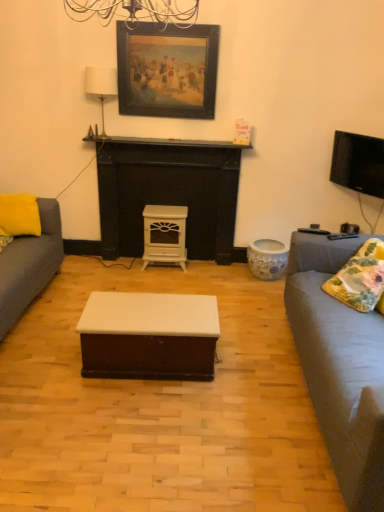
Describe the element at coordinates (340, 367) in the screenshot. This screenshot has height=512, width=384. I see `gray fabric couch at right` at that location.

This screenshot has height=512, width=384. Describe the element at coordinates (19, 215) in the screenshot. I see `yellow fabric pillow at left, which is the 1th pillow in back-to-front order` at that location.

The height and width of the screenshot is (512, 384). Identify the location of floral fabric pillow at right, which is the 1th pillow in right-to-left order. (361, 279).

Find the location of `white glossy wood stove at center`. white glossy wood stove at center is located at coordinates (165, 234).

Is black matte fireplace at center wider or thinner than gray fabric couch at right?

Clearly, black matte fireplace at center has less width compared to gray fabric couch at right.

In the image, is black matte fireplace at center on the left side or the right side of gray fabric couch at right?

Based on their positions, black matte fireplace at center is located to the left of gray fabric couch at right.

Who is smaller, black matte fireplace at center or gray fabric couch at right?

Smaller between the two is black matte fireplace at center.

Considering the points (89, 137) and (323, 389), which point is in front, point (89, 137) or point (323, 389)?

Positioned in front is point (323, 389).

From a real-world perspective, which object rests below the other?

white matte wood coffee table at center.

Is white matte wood coffee table at center facing towards white glossy wood fireplace at center?

Yes, white matte wood coffee table at center is oriented towards white glossy wood fireplace at center.

Considering the sizes of objects white matte wood coffee table at center and white glossy wood fireplace at center in the image provided, who is shorter, white matte wood coffee table at center or white glossy wood fireplace at center?

With less height is white matte wood coffee table at center.

Are white glossy wood fireplace at center and white matte wood coffee table at center located far from each other?

Yes, white glossy wood fireplace at center and white matte wood coffee table at center are quite far apart.

Can you confirm if white glossy wood fireplace at center is taller than white matte wood coffee table at center?

Indeed, white glossy wood fireplace at center has a greater height compared to white matte wood coffee table at center.

Which is behind, white glossy wood fireplace at center or white matte wood coffee table at center?

white glossy wood fireplace at center is further away from the camera.

Measure the distance between white glossy wood fireplace at center and white matte wood coffee table at center.

white glossy wood fireplace at center is 4.85 feet from white matte wood coffee table at center.

Is black matte fireplace at center to the left of white glossy wood fireplace at center from the viewer's perspective?

No.

Can white glossy wood fireplace at center be found inside black matte fireplace at center?

No.

From the image's perspective, which object appears higher, black matte fireplace at center or white glossy wood fireplace at center?

black matte fireplace at center is shown above in the image.

From a real-world perspective, which is physically below, black matte fireplace at center or white glossy wood fireplace at center?

white glossy wood fireplace at center is physically lower.

How much distance is there between wooden picture frame at upper center and white glossy wood fireplace at center?

wooden picture frame at upper center is 24.49 inches from white glossy wood fireplace at center.

From the image's perspective, which is above, wooden picture frame at upper center or white glossy wood fireplace at center?

wooden picture frame at upper center is shown above in the image.

Considering the sizes of objects wooden picture frame at upper center and white glossy wood fireplace at center in the image provided, who is wider, wooden picture frame at upper center or white glossy wood fireplace at center?

white glossy wood fireplace at center is wider.

The height and width of the screenshot is (512, 384). In order to click on picture frame lying on the right of white glossy wood fireplace at center in this screenshot , I will do `click(167, 70)`.

Consider the image. Does white glossy wood stove at center come behind black matte fireplace at center?

Yes, it is behind black matte fireplace at center.

Is white glossy wood stove at center aimed at black matte fireplace at center?

No.

Can you confirm if white glossy wood stove at center is thinner than black matte fireplace at center?

No, white glossy wood stove at center is not thinner than black matte fireplace at center.

Is white glossy wood stove at center inside or outside of black matte fireplace at center?

white glossy wood stove at center is not enclosed by black matte fireplace at center.

Measure the distance between white fabric lampshade at upper center and floral fabric pillow at right, placed as the 2th pillow when sorted from back to front.

white fabric lampshade at upper center and floral fabric pillow at right, placed as the 2th pillow when sorted from back to front, are 7.57 feet apart.

From the image's perspective, between white fabric lampshade at upper center and floral fabric pillow at right, which is the 1th pillow in front-to-back order, who is located below?

floral fabric pillow at right, which is the 1th pillow in front-to-back order, appears lower in the image.

Would you say white fabric lampshade at upper center is to the left or to the right of floral fabric pillow at right, the 2th pillow from the left, in the picture?

In the image, white fabric lampshade at upper center appears on the left side of floral fabric pillow at right, the 2th pillow from the left.

Identify the location of mantle above the gray fabric couch at right (from a real-world perspective). (x=164, y=142).

Find the location of a particular element. fireplace behind the white matte wood coffee table at center is located at coordinates (169, 193).

From the image, which object appears to be nearer to wooden picture frame at upper center, yellow fabric pillow at left, the 1th pillow from the left, or white fabric lampshade at upper center?

The object closer to wooden picture frame at upper center is white fabric lampshade at upper center.

Based on their spatial positions, is white fabric lampshade at upper center or white glossy wood stove at center closer to flat screen tv at upper right?

The object closer to flat screen tv at upper right is white glossy wood stove at center.

Based on their spatial positions, is white fabric lampshade at upper center or black matte fireplace at center further from white glossy wood stove at center?

white fabric lampshade at upper center.

Based on their spatial positions, is floral fabric pillow at right, placed as the 2th pillow when sorted from back to front, or white glossy wood fireplace at center further from flat screen tv at upper right?

white glossy wood fireplace at center is further to flat screen tv at upper right.

When comparing their distances from white matte wood coffee table at center, does white glossy wood fireplace at center or floral fabric pillow at right, which is the 1th pillow in front-to-back order, seem further?

Based on the image, white glossy wood fireplace at center appears to be further to white matte wood coffee table at center.

From the image, which object appears to be nearer to black matte fireplace at center, yellow fabric pillow at left, the 2th pillow from the right, or white matte wood coffee table at center?

Among the two, yellow fabric pillow at left, the 2th pillow from the right, is located nearer to black matte fireplace at center.

Considering their positions, is flat screen tv at upper right positioned closer to gray fabric couch at right than yellow fabric pillow at left, the 2th pillow positioned from the front?

flat screen tv at upper right.

When comparing their distances from white glossy wood stove at center, does yellow fabric pillow at left, which appears as the 2th pillow when ordered from the bottom, or flat screen tv at upper right seem further?

Among the two, flat screen tv at upper right is located further to white glossy wood stove at center.

This screenshot has height=512, width=384. In order to click on television positioned between gray fabric couch at right and black matte fireplace at center from near to far in this screenshot , I will do `click(358, 163)`.

At what (x,y) coordinates should I click in order to perform the action: click on mantle between wooden picture frame at upper center and white matte wood coffee table at center in the up-down direction. Please return your answer as a coordinate pair (x, y). The image size is (384, 512). Looking at the image, I should click on (164, 142).

Identify the location of pillow between white matte wood coffee table at center and gray fabric couch at right in the horizontal direction. This screenshot has height=512, width=384. (361, 279).

At what (x,y) coordinates should I click in order to perform the action: click on lamp between wooden picture frame at upper center and yellow fabric pillow at left, which appears as the 1th pillow when viewed from the top, in the vertical direction. Please return your answer as a coordinate pair (x, y). Looking at the image, I should click on (101, 85).